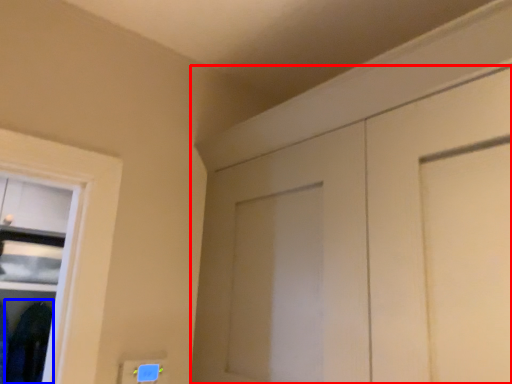
Question: Which of the following is the closest to the observer, door (highlighted by a red box) or clothing (highlighted by a blue box)?

Choices:
 (A) door
 (B) clothing

Answer: (A)